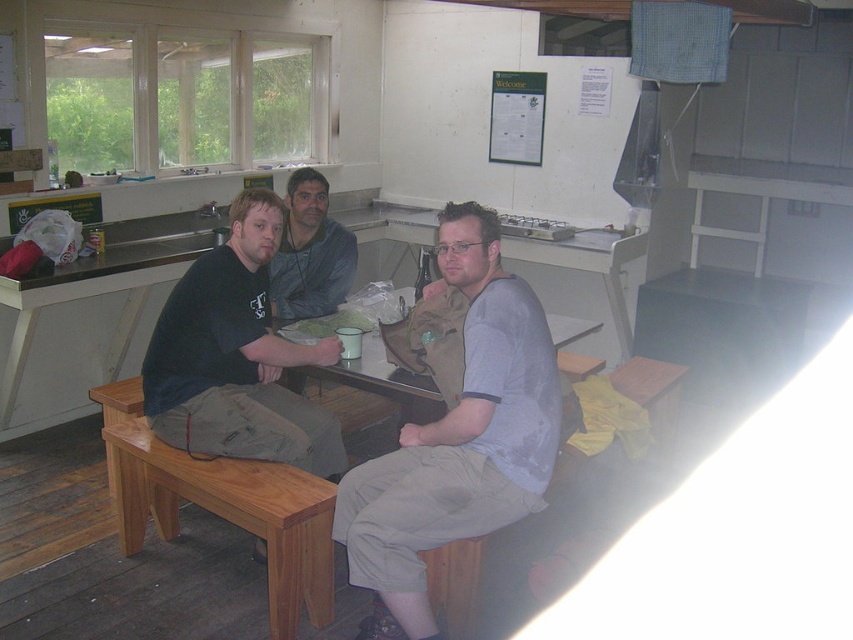
Question: From the image, what is the correct spatial relationship of gray cotton shirt at center in relation to matte gray jacket at center?

Choices:
 (A) left
 (B) right

Answer: (B)

Question: Which object is closer to the camera taking this photo?

Choices:
 (A) gray cotton shirt at center
 (B) light brown wood bench at lower left

Answer: (A)

Question: Does gray cotton shirt at center appear on the right side of light brown wood bench at lower left?

Choices:
 (A) yes
 (B) no

Answer: (A)

Question: Can you confirm if light brown wood bench at lower left is positioned to the right of matte gray jacket at center?

Choices:
 (A) yes
 (B) no

Answer: (B)

Question: Which object is positioned farthest from the matte gray jacket at center?

Choices:
 (A) light brown wood bench at lower left
 (B) gray cotton shirt at center

Answer: (B)

Question: Among these objects, which one is nearest to the camera?

Choices:
 (A) light brown wood bench at lower left
 (B) matte gray jacket at center
 (C) gray cotton shirt at center

Answer: (C)